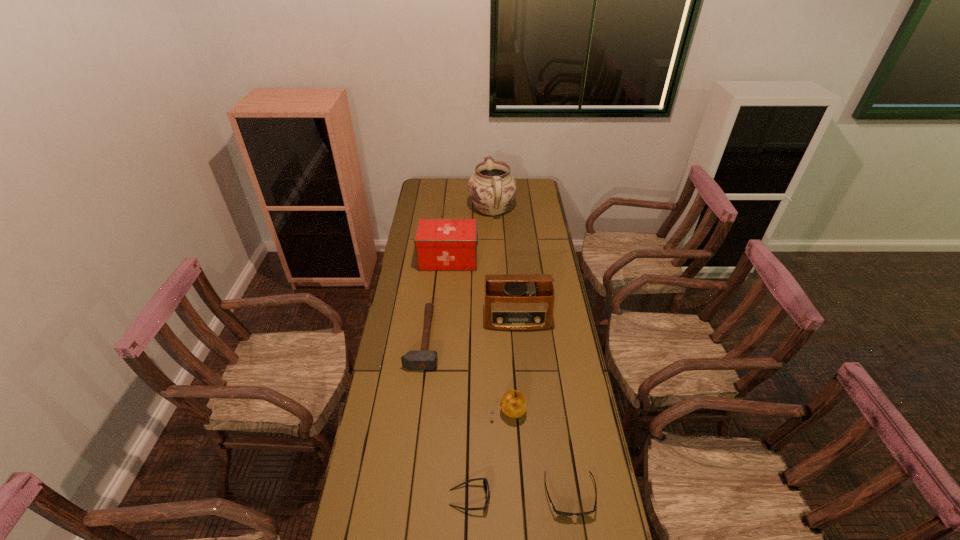
This screenshot has height=540, width=960. In order to click on pitcher in this screenshot , I will do `click(492, 188)`.

Where is `radio receiver`? radio receiver is located at coordinates (514, 302).

This screenshot has width=960, height=540. Find the location of `the third tallest object`. the third tallest object is located at coordinates (441, 244).

You are a GUI agent. You are given a task and a screenshot of the screen. Output one action in this format:
    pyautogui.click(x=<x>, y=<y>)
    Task: Click on the sixth nearest object
    The width and height of the screenshot is (960, 540).
    Given the screenshot: What is the action you would take?
    pyautogui.click(x=441, y=244)

Where is `the fourth shortest object`? This screenshot has height=540, width=960. the fourth shortest object is located at coordinates (513, 403).

You are a GUI agent. You are given a task and a screenshot of the screen. Output one action in this format:
    pyautogui.click(x=<x>, y=<y>)
    Task: Click on the fifth farthest object
    Image resolution: width=960 pixels, height=540 pixels.
    Given the screenshot: What is the action you would take?
    pyautogui.click(x=513, y=403)

Where is `hammer`? hammer is located at coordinates (413, 360).

Find the location of `the second shortest object`. the second shortest object is located at coordinates (485, 483).

Where is `the left sunglasses`? This screenshot has width=960, height=540. the left sunglasses is located at coordinates (485, 483).

Where is `the shorter sunglasses`? the shorter sunglasses is located at coordinates (560, 513).